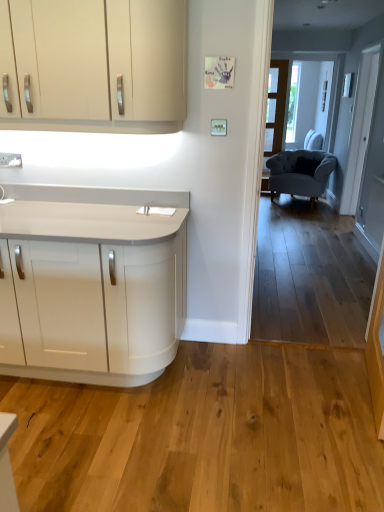
Question: Is white glossy countertop at lower left in front of or behind matte white cabinets at upper left in the image?

Choices:
 (A) behind
 (B) front

Answer: (A)

Question: Is white glossy countertop at lower left wider or thinner than matte white cabinets at upper left?

Choices:
 (A) wide
 (B) thin

Answer: (A)

Question: Which object is positioned farthest from the velvet grey armchair at right?

Choices:
 (A) clear glass door at center
 (B) white glossy countertop at lower left
 (C) white glossy door at upper right
 (D) matte white cabinets at upper left

Answer: (B)

Question: Estimate the real-world distances between objects in this image. Which object is closer to the white glossy countertop at lower left?

Choices:
 (A) matte white cabinets at upper left
 (B) velvet grey armchair at right
 (C) white glossy door at upper right
 (D) clear glass door at center

Answer: (A)